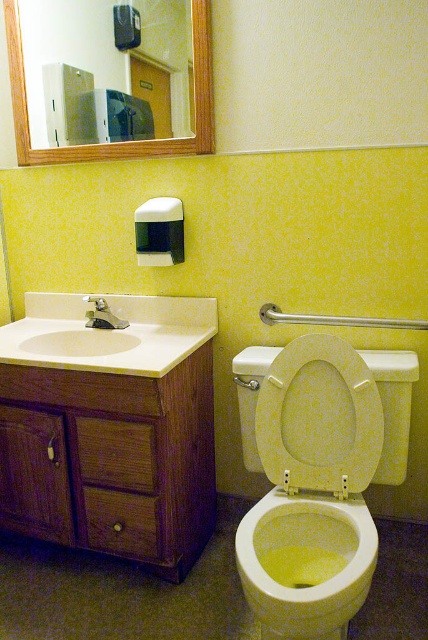
Is point (394, 438) closer to viewer compared to point (309, 336)?

No, it is behind (309, 336).

Between white speckled porcelain toilet at right and yellow speckled plastic toilet seat at center, which one appears on the left side from the viewer's perspective?

From the viewer's perspective, white speckled porcelain toilet at right appears more on the left side.

Identify the location of white speckled porcelain toilet at right. This screenshot has width=428, height=640. (318, 476).

Is yellow matte toilet bowl at center below wooden frame mirror at upper left?

Yes, yellow matte toilet bowl at center is below wooden frame mirror at upper left.

Is yellow matte toilet bowl at center taller than wooden frame mirror at upper left?

No, yellow matte toilet bowl at center is not taller than wooden frame mirror at upper left.

Who is more forward, (279, 548) or (175, 147)?

Point (279, 548) is more forward.

The width and height of the screenshot is (428, 640). I want to click on yellow matte toilet bowl at center, so click(x=306, y=563).

Is white speckled porcelain toilet at right below brushed metal faucet at sink left?

Yes, white speckled porcelain toilet at right is below brushed metal faucet at sink left.

Which of these two, white speckled porcelain toilet at right or brushed metal faucet at sink left, stands taller?

Standing taller between the two is white speckled porcelain toilet at right.

I want to click on white speckled porcelain toilet at right, so click(x=318, y=476).